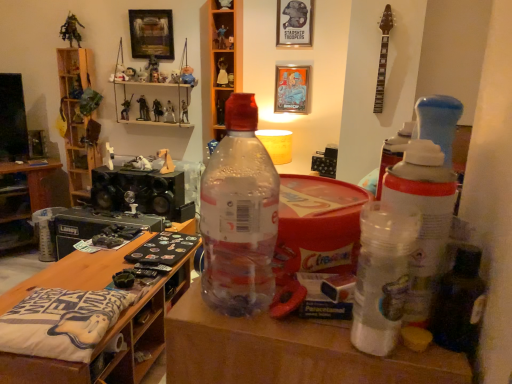
This screenshot has width=512, height=384. Identify the location of vacant space in front of white fabric dog at center, which is the sixth toy from left to right. (139, 171).